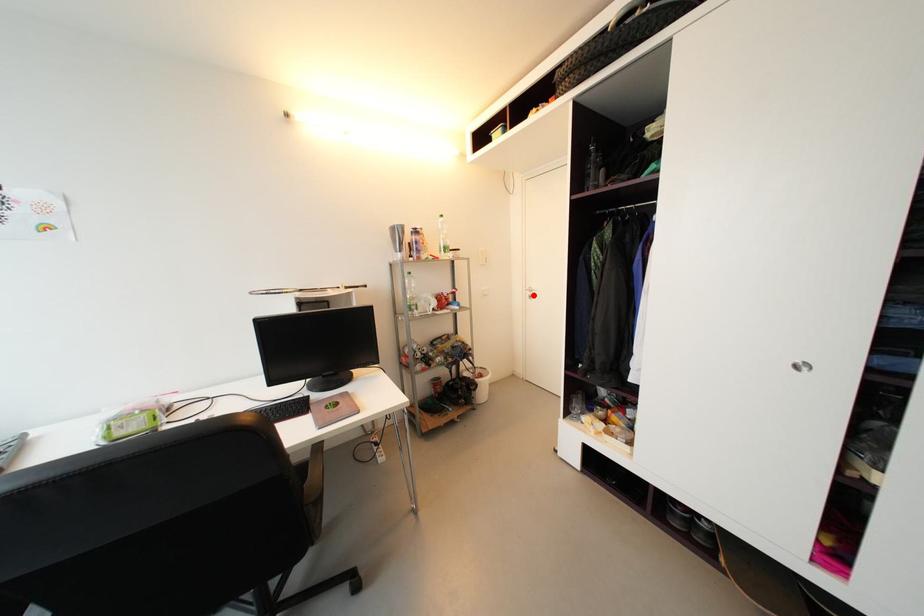
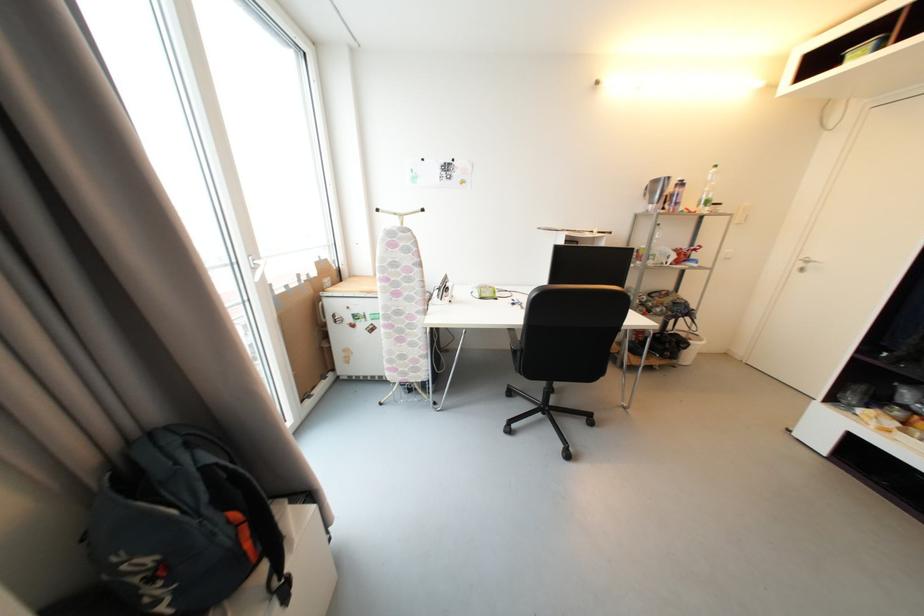
In the second image, find the point that corresponds to the highlighted location in the first image.

(806, 267)